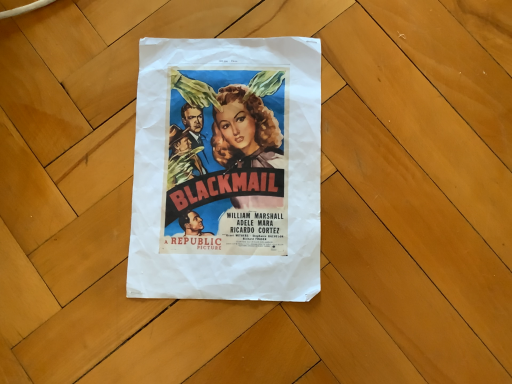
Where is `free space above matte paper poster at center (from a real-world perspective)`? The image size is (512, 384). free space above matte paper poster at center (from a real-world perspective) is located at coordinates (229, 158).